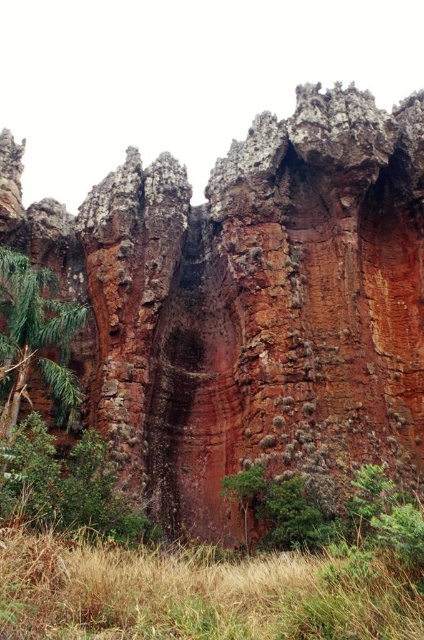
Question: Which point is farther to the camera?

Choices:
 (A) green leafy tree at left
 (B) brown dry grass at lower center

Answer: (A)

Question: Among these objects, which one is nearest to the camera?

Choices:
 (A) rusty rock cliff at center
 (B) green leafy tree at left

Answer: (A)

Question: Does rusty rock cliff at center have a smaller size compared to green leafy tree at left?

Choices:
 (A) no
 (B) yes

Answer: (A)

Question: Is rusty rock cliff at center closer to the viewer compared to green leafy tree at left?

Choices:
 (A) yes
 (B) no

Answer: (A)

Question: Is brown dry grass at lower center thinner than green leafy tree at left?

Choices:
 (A) no
 (B) yes

Answer: (A)

Question: Which point is farther to the camera?

Choices:
 (A) brown dry grass at lower center
 (B) green leafy tree at left

Answer: (B)